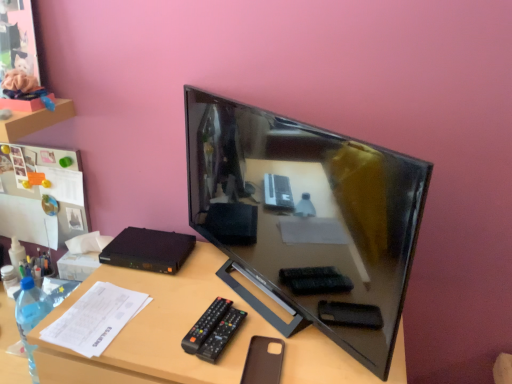
Identify the location of vacant area that is situated to the right of white paper at lower left. (168, 312).